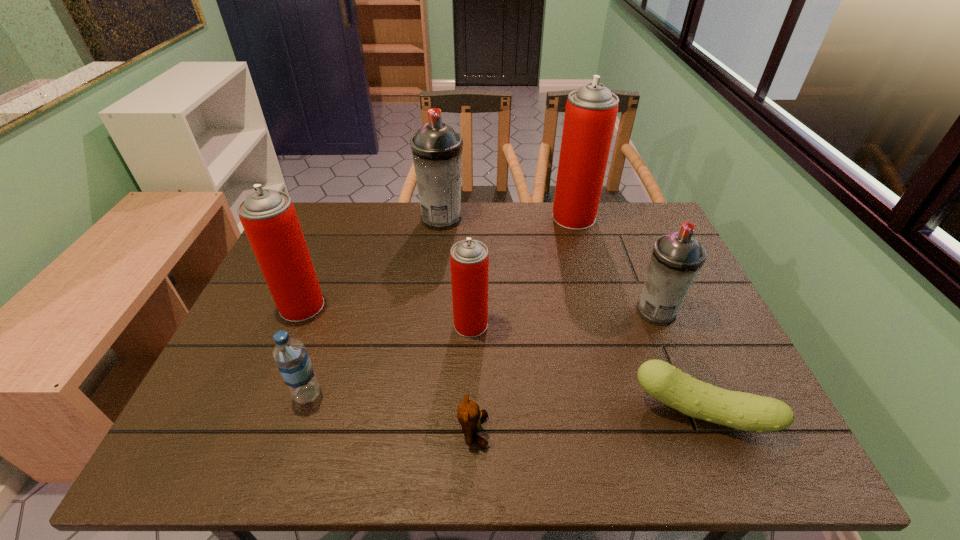
Where is `the second aerosol can from right to left`? The width and height of the screenshot is (960, 540). the second aerosol can from right to left is located at coordinates (591, 111).

This screenshot has height=540, width=960. I want to click on the farthest red aerosol can, so (x=591, y=111).

This screenshot has height=540, width=960. I want to click on the left gray aerosol can, so click(436, 148).

Where is `the bigger gray aerosol can`? The image size is (960, 540). the bigger gray aerosol can is located at coordinates (436, 148).

In order to click on the second smallest red aerosol can in this screenshot , I will do `click(269, 218)`.

Find the location of a particular element. The width and height of the screenshot is (960, 540). the leftmost red aerosol can is located at coordinates (269, 218).

You are a GUI agent. You are given a task and a screenshot of the screen. Output one action in this format:
    pyautogui.click(x=<x>, y=<y>)
    Task: Click on the second red aerosol can from right to left
    The image size is (960, 540).
    Given the screenshot: What is the action you would take?
    pos(469,259)

Where is `the nearer gray aerosol can`? This screenshot has width=960, height=540. the nearer gray aerosol can is located at coordinates (677, 258).

Locate an element on the screen. This screenshot has width=960, height=540. the right gray aerosol can is located at coordinates (677, 258).

Identify the location of water bottle. (290, 355).